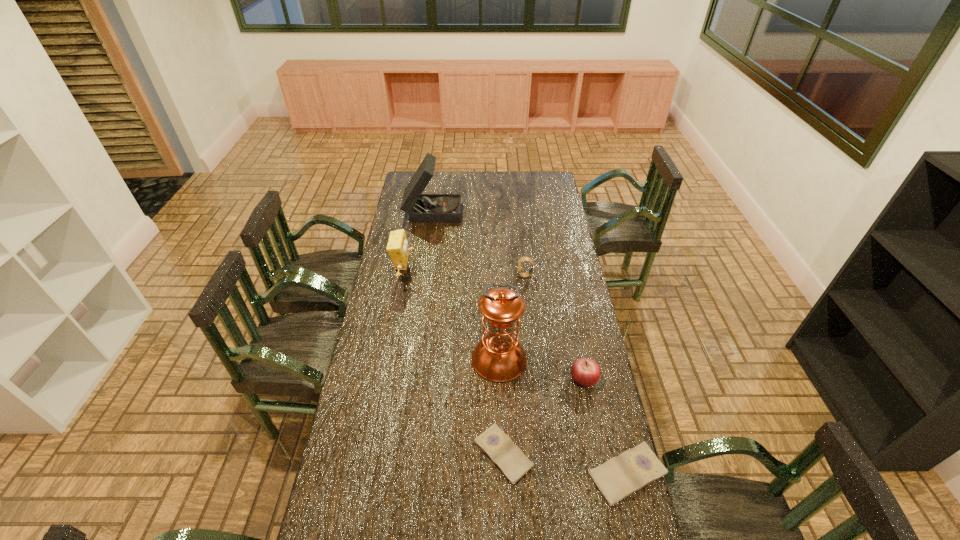
Image resolution: width=960 pixels, height=540 pixels. I want to click on blank region between the fifth shortest object and the left diary, so click(454, 364).

I want to click on empty location between the apple and the oil lamp, so click(541, 369).

This screenshot has width=960, height=540. I want to click on object identified as the second closest to the apple, so click(x=620, y=476).

Image resolution: width=960 pixels, height=540 pixels. I want to click on object that is the second closest to the apple, so click(620, 476).

Find the location of a particular element. blank space that satisfies the following two spatial constraints: 1. on the back side of the apple; 2. on the face of the watch is located at coordinates (563, 275).

Image resolution: width=960 pixels, height=540 pixels. I want to click on vacant space that satisfies the following two spatial constraints: 1. on the face of the taller diary; 2. on the right side of the third tallest object, so click(x=369, y=474).

Locate an element on the screen. The height and width of the screenshot is (540, 960). vacant space that satisfies the following two spatial constraints: 1. on the face of the second shortest object; 2. on the left side of the third tallest object is located at coordinates (369, 474).

Image resolution: width=960 pixels, height=540 pixels. In order to click on vacant space that satisfies the following two spatial constraints: 1. on the front side of the apple; 2. on the right side of the second shortest object in this screenshot , I will do `click(603, 474)`.

Find the location of a particular element. vacant space that satisfies the following two spatial constraints: 1. on the face of the sponge; 2. on the right side of the oil lamp is located at coordinates (390, 359).

You are a GUI agent. You are given a task and a screenshot of the screen. Output one action in this format:
    pyautogui.click(x=<x>, y=<y>)
    Task: Click on the free location that satisfies the following two spatial constraints: 1. on the front-facing side of the second shortest object; 2. on the right side of the farthest object
    This screenshot has width=960, height=540.
    Given the screenshot: What is the action you would take?
    pyautogui.click(x=397, y=474)